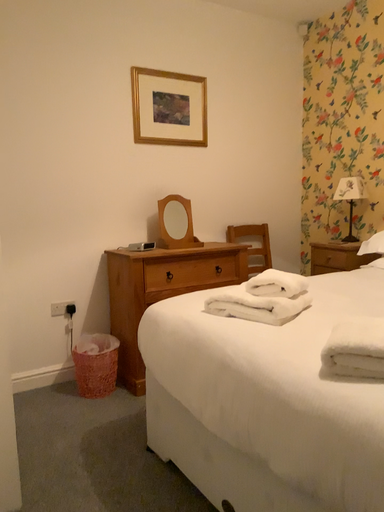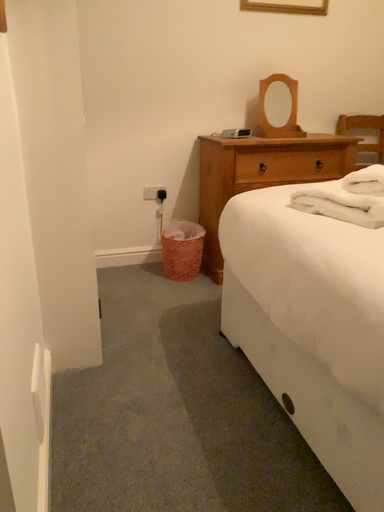
Question: Which way did the camera rotate in the video?

Choices:
 (A) rotated upward
 (B) rotated downward

Answer: (B)